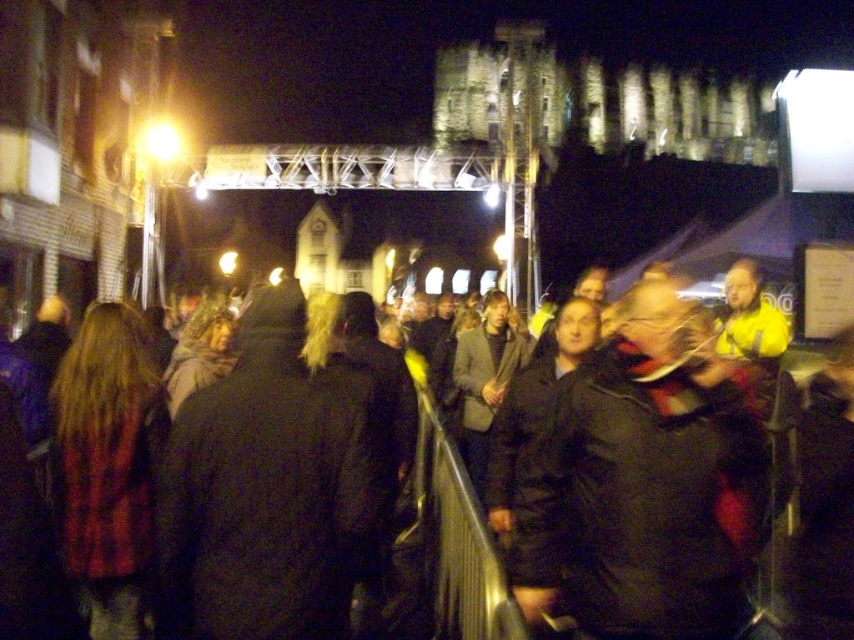
Question: Which of the following is the closest to the observer?

Choices:
 (A) (580, 508)
 (B) (823, 554)

Answer: (A)

Question: Which point is farther from the camera taking this photo?

Choices:
 (A) (662, 563)
 (B) (793, 540)

Answer: (B)

Question: Is dark gray jacket at center positioned behind dark wool coat at center?

Choices:
 (A) yes
 (B) no

Answer: (B)

Question: Is dark gray jacket at center wider than dark wool coat at center?

Choices:
 (A) no
 (B) yes

Answer: (A)

Question: Is dark gray jacket at center behind dark wool coat at center?

Choices:
 (A) yes
 (B) no

Answer: (B)